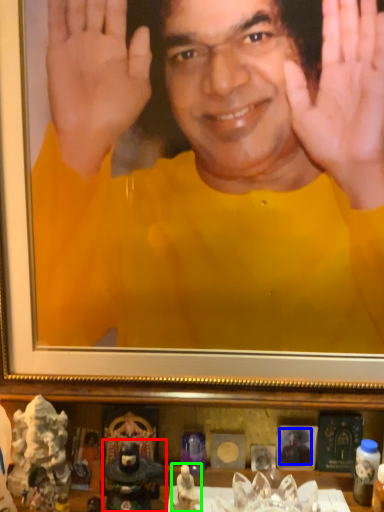
Question: Which is nearer to the figurine (highlighted by a red box)? man (highlighted by a blue box) or toy (highlighted by a green box).

Choices:
 (A) man
 (B) toy

Answer: (B)